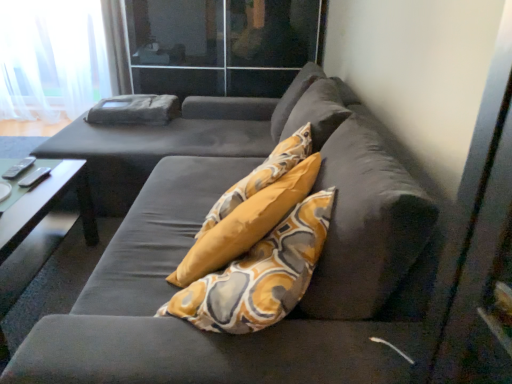
Question: Is green glossy table at lower left at the right side of velvet dark gray couch at center?

Choices:
 (A) no
 (B) yes

Answer: (A)

Question: Considering the relative sizes of green glossy table at lower left and velvet dark gray couch at center in the image provided, is green glossy table at lower left wider than velvet dark gray couch at center?

Choices:
 (A) yes
 (B) no

Answer: (B)

Question: Does green glossy table at lower left come behind velvet dark gray couch at center?

Choices:
 (A) no
 (B) yes

Answer: (B)

Question: Is green glossy table at lower left next to velvet dark gray couch at center?

Choices:
 (A) no
 (B) yes

Answer: (A)

Question: Is velvet dark gray couch at center located within green glossy table at lower left?

Choices:
 (A) yes
 (B) no

Answer: (B)

Question: Looking at the image, does green glossy table at lower left seem bigger or smaller compared to velvet dark gray couch at center?

Choices:
 (A) big
 (B) small

Answer: (B)

Question: From a real-world perspective, is green glossy table at lower left above or below velvet dark gray couch at center?

Choices:
 (A) above
 (B) below

Answer: (B)

Question: In the image, is green glossy table at lower left positioned in front of or behind velvet dark gray couch at center?

Choices:
 (A) front
 (B) behind

Answer: (B)

Question: Is green glossy table at lower left situated inside velvet dark gray couch at center or outside?

Choices:
 (A) inside
 (B) outside

Answer: (A)

Question: From a real-world perspective, is transparent glass door at upper center physically located above or below velvet dark gray couch at center?

Choices:
 (A) below
 (B) above

Answer: (B)

Question: Based on their sizes in the image, would you say transparent glass door at upper center is bigger or smaller than velvet dark gray couch at center?

Choices:
 (A) small
 (B) big

Answer: (A)

Question: From the image's perspective, is transparent glass door at upper center located above or below velvet dark gray couch at center?

Choices:
 (A) above
 (B) below

Answer: (A)

Question: Is transparent glass door at upper center situated inside velvet dark gray couch at center or outside?

Choices:
 (A) outside
 (B) inside

Answer: (A)

Question: From the image's perspective, is transparent glass door at upper center positioned above or below green glossy table at lower left?

Choices:
 (A) above
 (B) below

Answer: (A)

Question: From a real-world perspective, is transparent glass door at upper center above or below green glossy table at lower left?

Choices:
 (A) below
 (B) above

Answer: (B)